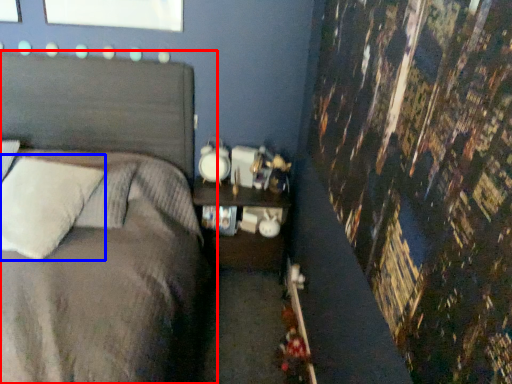
Question: Which of the following is the farthest to the observer, bed (highlighted by a red box) or pillow (highlighted by a blue box)?

Choices:
 (A) bed
 (B) pillow

Answer: (B)